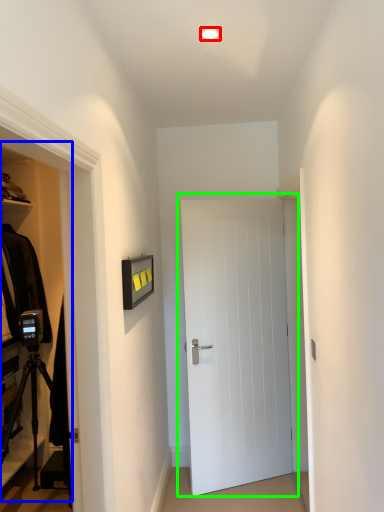
Question: Estimate the real-world distances between objects in this image. Which object is closer to lighting (highlighted by a red box), dresser (highlighted by a blue box) or door (highlighted by a green box)?

Choices:
 (A) dresser
 (B) door

Answer: (B)